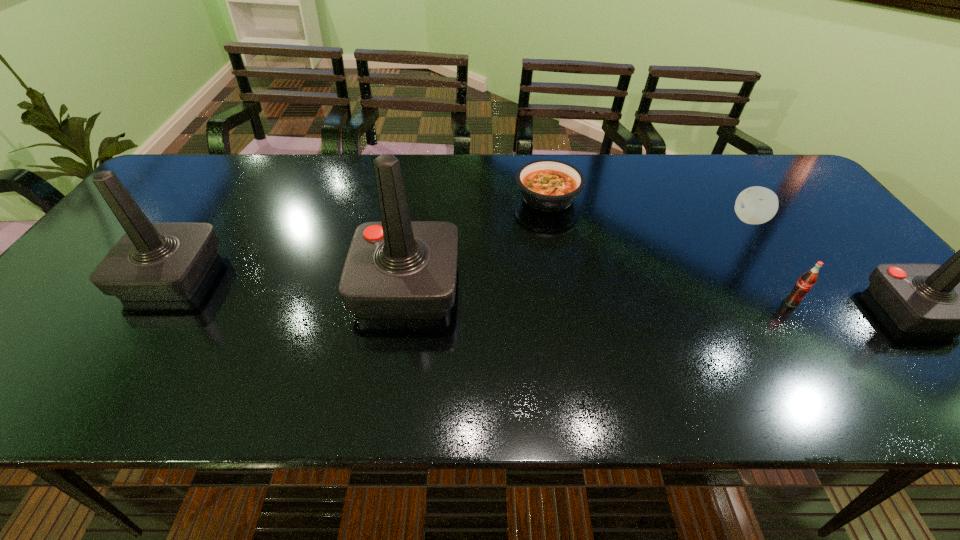
If the aim is uniform spacing by inserting an additional joystick among them, please point to a vacant space for this new joystick. Please provide its 2D coordinates. Your answer should be formatted as a tuple, i.e. [(x, y)], where the tuple contains the x and y coordinates of a point satisfying the conditions above.

[(654, 298)]